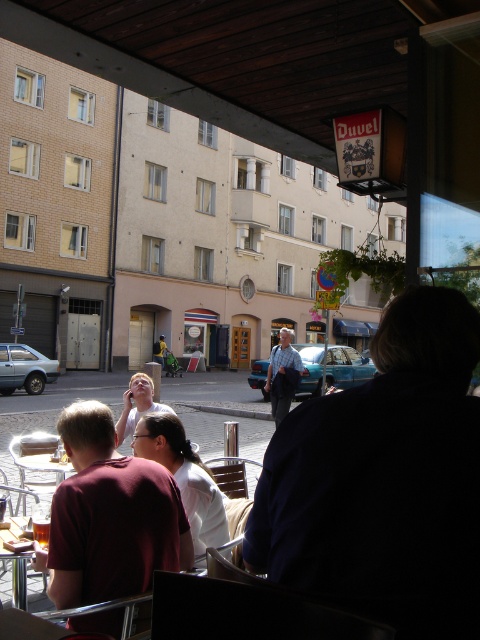
Question: Does maroon shirt at center have a smaller size compared to light blue shirt at center?

Choices:
 (A) no
 (B) yes

Answer: (B)

Question: Based on their relative distances, which object is farther from the maroon shirt at center?

Choices:
 (A) wooden table at lower left
 (B) dark blue shirt at center
 (C) light blue shirt at center
 (D) light brown hair at center

Answer: (C)

Question: Which object is positioned closest to the maroon shirt at center?

Choices:
 (A) dark blue shirt at center
 (B) light blue shirt at center
 (C) light brown hair at center

Answer: (A)

Question: Which point is closer to the camera taking this photo?

Choices:
 (A) (22, 595)
 (B) (122, 419)
 (C) (403, 602)

Answer: (C)

Question: Is dark blue shirt at center thinner than maroon shirt at center?

Choices:
 (A) yes
 (B) no

Answer: (B)

Question: Does wooden table at lower left have a larger size compared to light brown hair at center?

Choices:
 (A) yes
 (B) no

Answer: (B)